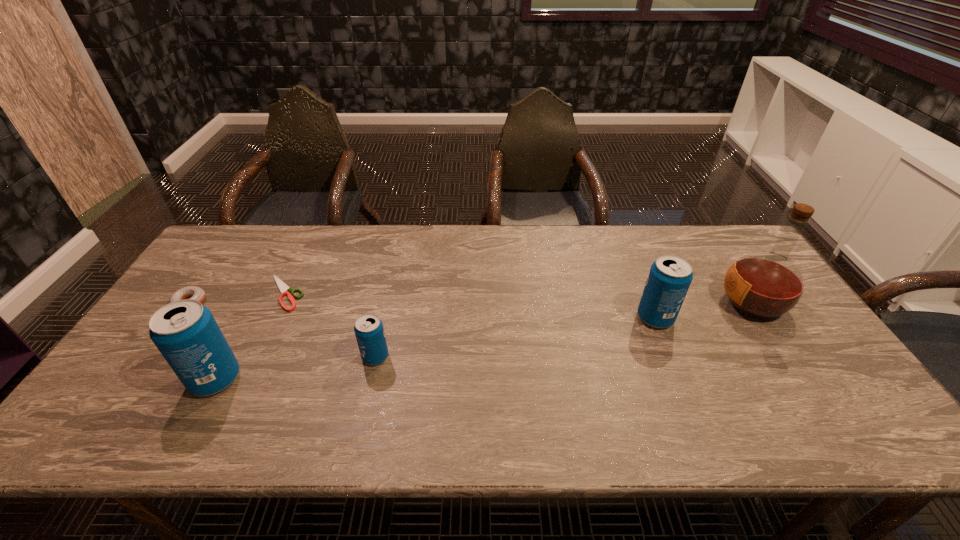
Locate an element on the screen. the leftmost soda can is located at coordinates coord(185,332).

Locate an element on the screen. The height and width of the screenshot is (540, 960). the fourth tallest object is located at coordinates (369, 331).

Find the location of a particular element. the shortest soda can is located at coordinates (369, 331).

Where is `the second shortest soda can`? The image size is (960, 540). the second shortest soda can is located at coordinates (670, 276).

At what (x,y) coordinates should I click in order to perform the action: click on the rightmost soda can. Please return your answer as a coordinate pair (x, y). The height and width of the screenshot is (540, 960). Looking at the image, I should click on (670, 276).

The height and width of the screenshot is (540, 960). I want to click on liquor, so click(x=764, y=285).

Where is `the rightmost object`? Image resolution: width=960 pixels, height=540 pixels. the rightmost object is located at coordinates (764, 285).

Identify the location of the shortest object. (283, 287).

Locate an element on the screen. doughnut is located at coordinates (196, 293).

Locate an element on the screen. The width and height of the screenshot is (960, 540). the fifth tallest object is located at coordinates (196, 293).